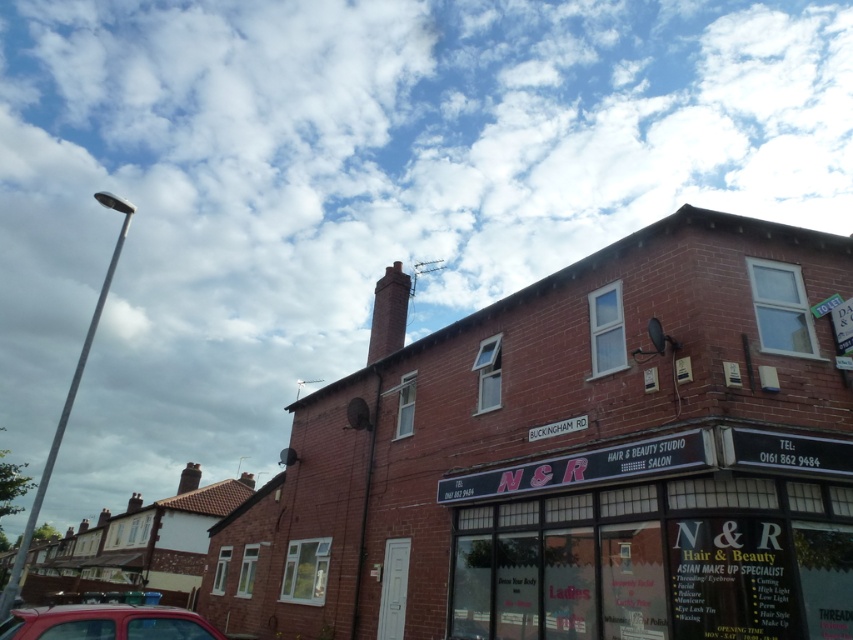
Question: Which object appears farthest from the camera in this image?

Choices:
 (A) red brick chimney at upper center
 (B) brick building at center
 (C) black glass signboard at center

Answer: (A)

Question: Which point is closer to the camera?

Choices:
 (A) (605, 513)
 (B) (398, 275)
 (C) (152, 616)
 (D) (618, 449)

Answer: (C)

Question: Is brick building at center bigger than black glass signboard at center?

Choices:
 (A) yes
 (B) no

Answer: (A)

Question: Does black glass signboard at center have a greater width compared to red brick chimney at upper center?

Choices:
 (A) no
 (B) yes

Answer: (B)

Question: Which is farther from the brick building at center?

Choices:
 (A) black glass signboard at center
 (B) matte red car at lower left
 (C) red brick chimney at upper center

Answer: (B)

Question: Can you confirm if matte red car at lower left is positioned to the right of red brick chimney at upper center?

Choices:
 (A) yes
 (B) no

Answer: (B)